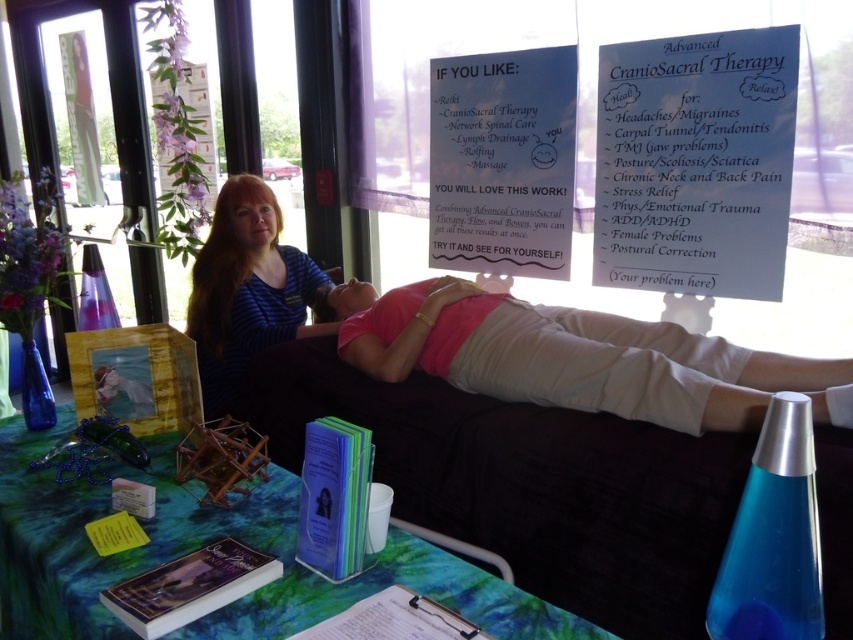
Which is behind, point (827, 360) or point (572, 177)?

Positioned behind is point (572, 177).

Is pink fabric at center positioned at the back of white paper sign at upper center?

No.

Measure the distance between pink fabric at center and camera.

pink fabric at center and camera are 4.56 feet apart from each other.

The height and width of the screenshot is (640, 853). In order to click on pink fabric at center in this screenshot , I will do (573, 356).

The height and width of the screenshot is (640, 853). In order to click on pink fabric at center in this screenshot , I will do click(x=573, y=356).

Does pink fabric at center have a greater height compared to blue striped shirt at center?

Incorrect, pink fabric at center's height is not larger of blue striped shirt at center's.

This screenshot has width=853, height=640. Describe the element at coordinates (573, 356) in the screenshot. I see `pink fabric at center` at that location.

This screenshot has width=853, height=640. Find the location of `pink fabric at center`. pink fabric at center is located at coordinates (573, 356).

Between white paper sign at upper right and blue striped shirt at center, which one has more height?

blue striped shirt at center is taller.

Who is more distant from viewer, (635, 236) or (270, 237)?

Positioned behind is point (270, 237).

The width and height of the screenshot is (853, 640). What do you see at coordinates (695, 163) in the screenshot?
I see `white paper sign at upper right` at bounding box center [695, 163].

What are the coordinates of `white paper sign at upper right` in the screenshot? It's located at (695, 163).